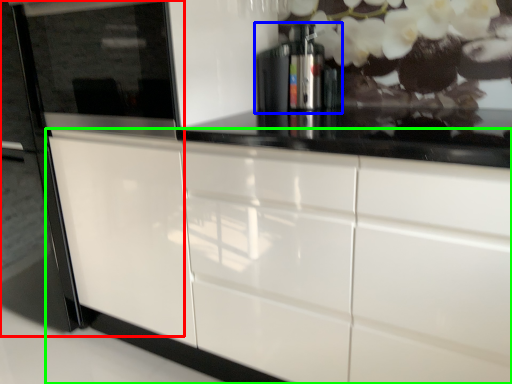
Question: Considering the real-world distances, which object is closest to fridge (highlighted by a red box)? coffee machine (highlighted by a blue box) or cabinetry (highlighted by a green box).

Choices:
 (A) coffee machine
 (B) cabinetry

Answer: (B)